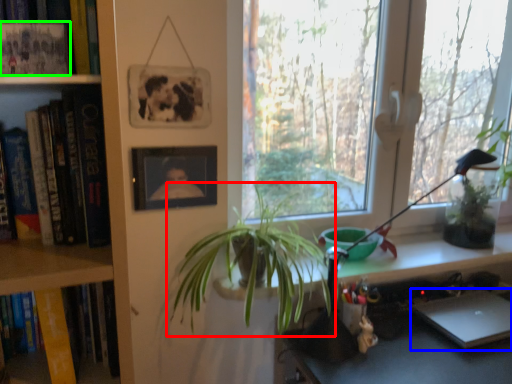
Question: Which is farther away from houseplant (highlighted by a red box)? laptop (highlighted by a blue box) or book (highlighted by a green box)?

Choices:
 (A) laptop
 (B) book

Answer: (B)